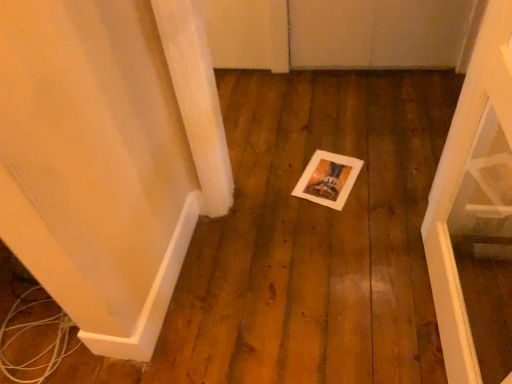
Identify the location of white wood door at right. (476, 215).

Describe the element at coordinates (476, 215) in the screenshot. I see `white wood door at right` at that location.

This screenshot has height=384, width=512. Identify the location of white paper postcard at center. (328, 179).

The width and height of the screenshot is (512, 384). What do you see at coordinates (328, 179) in the screenshot? I see `white paper postcard at center` at bounding box center [328, 179].

Locate an element on the screen. white wood door at right is located at coordinates (476, 215).

Is white paper postcard at center at the right side of white wood door at right?

No, white paper postcard at center is not to the right of white wood door at right.

Considering the positions of objects white paper postcard at center and white wood door at right in the image provided, who is in front, white paper postcard at center or white wood door at right?

Positioned in front is white wood door at right.

Is point (332, 173) positioned in front of point (508, 31)?

No, it is not.

From the image's perspective, between white paper postcard at center and white wood door at right, who is located below?

white wood door at right is shown below in the image.

From a real-world perspective, is white paper postcard at center on white wood door at right?

No, from a real-world perspective, white paper postcard at center is not on top of white wood door at right.

Between white paper postcard at center and white wood door at right, which one has larger width?

With larger width is white paper postcard at center.

Which of these two, white paper postcard at center or white wood door at right, stands taller?

Standing taller between the two is white wood door at right.

Which of these two, white paper postcard at center or white wood door at right, is smaller?

white paper postcard at center.

Is white wood door at right completely or partially inside white paper postcard at center?

No, white wood door at right is not surrounded by white paper postcard at center.

Is white paper postcard at center placed right next to white wood door at right?

No, white paper postcard at center is not beside white wood door at right.

Is white paper postcard at center oriented towards white wood door at right?

No, white paper postcard at center is not facing towards white wood door at right.

What's the angular difference between white paper postcard at center and white wood door at right's facing directions?

The angle between the facing direction of white paper postcard at center and the facing direction of white wood door at right is 71.7 degrees.

The image size is (512, 384). I want to click on door on the right side of white paper postcard at center, so click(x=476, y=215).

Does white wood door at right appear on the left side of white paper postcard at center?

No, white wood door at right is not to the left of white paper postcard at center.

Which object is closer to the camera taking this photo, white wood door at right or white paper postcard at center?

Positioned in front is white wood door at right.

Which is in front, point (504, 19) or point (341, 207)?

The point (504, 19) is more forward.

From the image's perspective, is white wood door at right above or below white paper postcard at center?

white wood door at right is below white paper postcard at center.

From a real-world perspective, is white wood door at right beneath white paper postcard at center?

No, from a real-world perspective, white wood door at right is not beneath white paper postcard at center.

Can you confirm if white wood door at right is wider than white paper postcard at center?

In fact, white wood door at right might be narrower than white paper postcard at center.

Can you confirm if white wood door at right is taller than white paper postcard at center?

Indeed, white wood door at right has a greater height compared to white paper postcard at center.

Which of these two, white wood door at right or white paper postcard at center, is smaller?

Smaller between the two is white paper postcard at center.

Is white wood door at right located outside white paper postcard at center?

Indeed, white wood door at right is completely outside white paper postcard at center.

Based on the photo, is white wood door at right far from white paper postcard at center?

No.

Is white paper postcard at center at the back of white wood door at right?

No, white wood door at right is not facing the opposite direction of white paper postcard at center.

You are a GUI agent. You are given a task and a screenshot of the screen. Output one action in this format:
    pyautogui.click(x=<x>, y=<y>)
    Task: Click on the door above the white paper postcard at center (from a real-world perspective)
    Image resolution: width=512 pixels, height=384 pixels.
    Given the screenshot: What is the action you would take?
    pyautogui.click(x=476, y=215)

Where is `door above the white paper postcard at center (from a real-world perspective)`? door above the white paper postcard at center (from a real-world perspective) is located at coordinates (476, 215).

Image resolution: width=512 pixels, height=384 pixels. I want to click on postcard below the white wood door at right (from a real-world perspective), so click(328, 179).